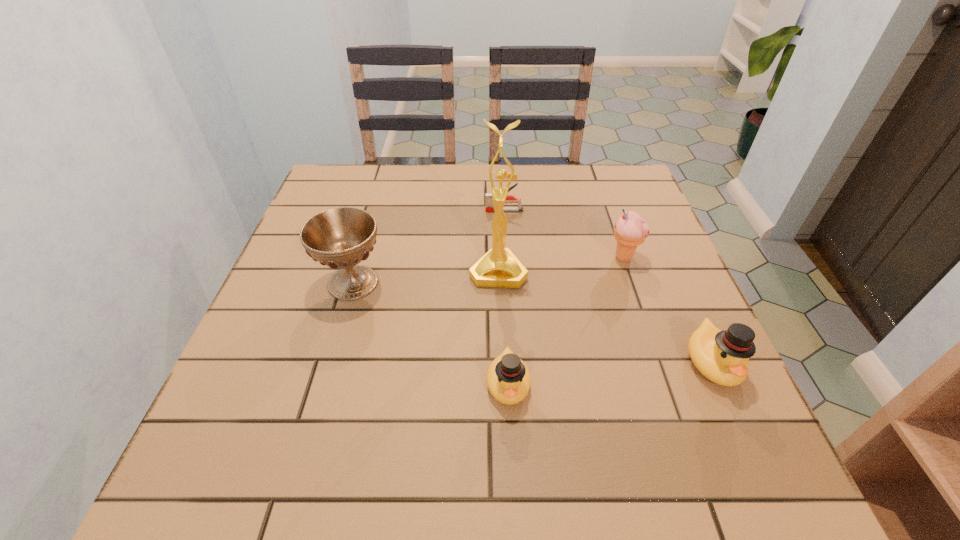
Identify the location of empty location between the third shortest object and the leftmost object. (533, 322).

The width and height of the screenshot is (960, 540). What are the coordinates of `empty location between the taller duck and the farthest object` in the screenshot? It's located at (608, 287).

I want to click on the fourth closest object to the third shortest object, so click(x=489, y=206).

The height and width of the screenshot is (540, 960). Find the location of `object that stands as the fourth closest to the stapler`. object that stands as the fourth closest to the stapler is located at coordinates (508, 378).

Locate an element on the screen. Image resolution: width=960 pixels, height=540 pixels. vacant space that satisfies the following two spatial constraints: 1. on the back side of the icecream; 2. on the handle side of the stapler is located at coordinates (607, 211).

Where is `free space that satisfies the following two spatial constraints: 1. on the handle side of the farthest object; 2. on the back side of the icecream`? The height and width of the screenshot is (540, 960). free space that satisfies the following two spatial constraints: 1. on the handle side of the farthest object; 2. on the back side of the icecream is located at coordinates (508, 258).